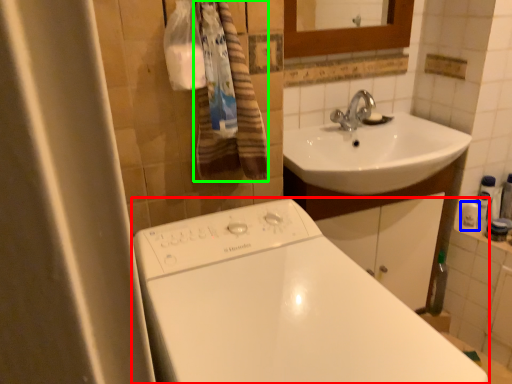
Question: Which is nearer to the bathtub (highlighted by a red box)? toiletry (highlighted by a blue box) or bath towel (highlighted by a green box).

Choices:
 (A) toiletry
 (B) bath towel

Answer: (B)